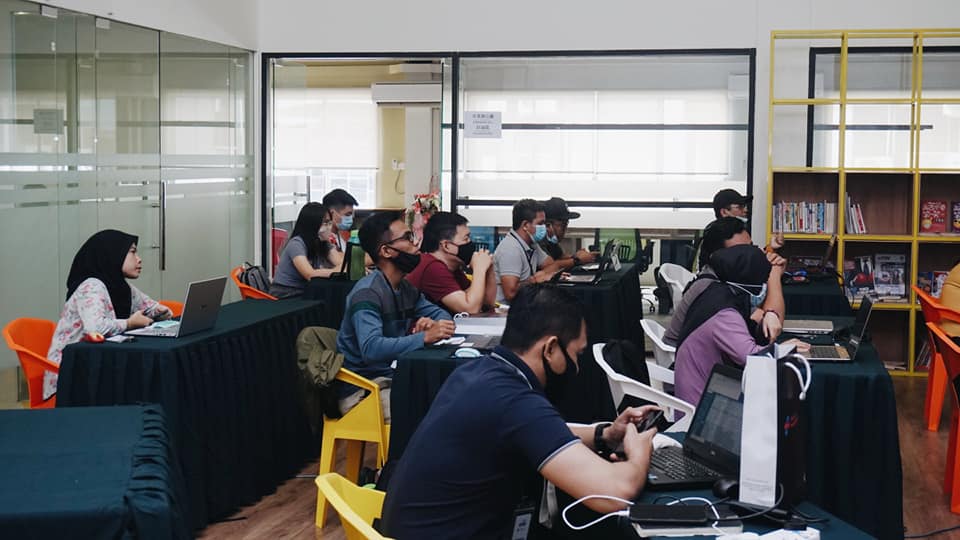
Find the location of a particular element. This screenshot has height=540, width=960. table is located at coordinates (61, 447), (260, 310), (437, 362), (851, 387).